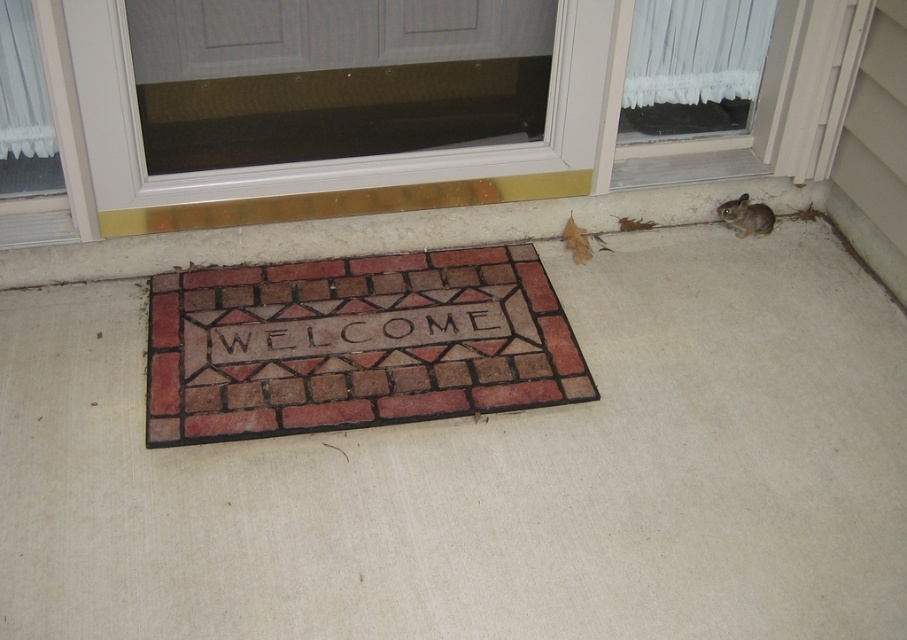
Question: Can you confirm if transparent glass door at upper center is bigger than brown furry squirrel at lower right?

Choices:
 (A) yes
 (B) no

Answer: (A)

Question: Does brick-patterned welcome mat at center appear over white brick-like at center?

Choices:
 (A) no
 (B) yes

Answer: (B)

Question: Which object appears farthest from the camera in this image?

Choices:
 (A) brown furry squirrel at lower right
 (B) brick-patterned welcome mat at center
 (C) white brick-like at center
 (D) transparent glass door at upper center

Answer: (A)

Question: Considering the real-world distances, which object is closest to the white brick-like at center?

Choices:
 (A) transparent glass door at upper center
 (B) brown furry squirrel at lower right
 (C) brick-patterned welcome mat at center

Answer: (C)

Question: Which of the following is the closest to the observer?

Choices:
 (A) brown furry squirrel at lower right
 (B) brick-patterned welcome mat at center
 (C) white brick-like at center
 (D) transparent glass door at upper center

Answer: (B)

Question: Can you confirm if brick-patterned welcome mat at center is positioned below white brick-like at center?

Choices:
 (A) no
 (B) yes

Answer: (A)